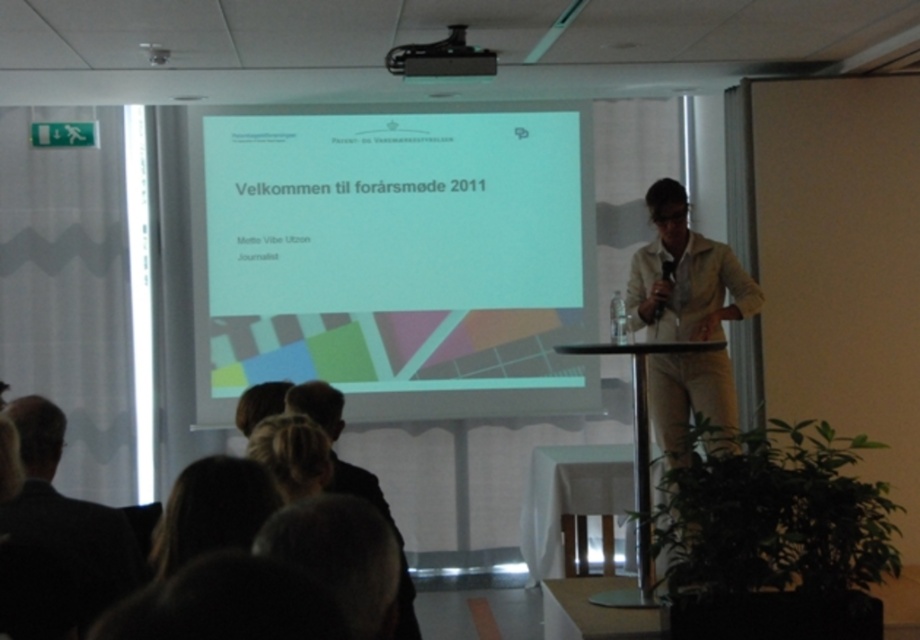
You are an attendee sitting in the front row and want to take a photo of the speaker and the projection screen. Since you only have a 30cm wide camera lens, can you fit both the white matte projection screen at center and the dark brown hair at lower center into your photo without moving your position?

The white matte projection screen at center is positioned on the left side of dark brown hair at lower center. Since the objects are aligned horizontally, the total width required would be the sum of their individual widths. However, the description does not provide specific measurements for their widths, so it is impossible to determine if they can fit within the 30cm lens width. Additional information about their sizes is needed to answer accurately.

You are an event organizer who needs to set up a new microphone stand. The stand requires 1 meter of space to the left of the dark suit at lower left and 0.5 meters to the right of the black plastic projector at upper center. Is there enough space between them for the stand?

The dark suit at lower left might be wider than the black plastic projector at upper center, so the required space for the microphone stand may not be sufficient. Check the actual distance before placing the stand.

You are an event planner checking the conference room setup. You need to ensure that the white matte projection screen at center is visible to all attendees. Considering the dark brown hair at lower center, which is blocking part of the screen, is the screen still visible to the audience?

The white matte projection screen at center has a larger width than the dark brown hair at lower center, so even if the hair is blocking part of the screen, the majority of the screen remains visible to the audience.